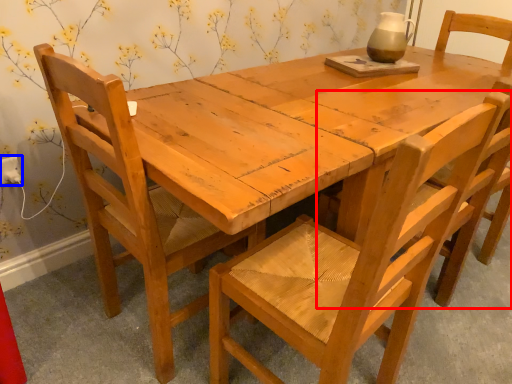
Question: Which of the following is the closest to the observer, chair (highlighted by a red box) or electric outlet (highlighted by a blue box)?

Choices:
 (A) chair
 (B) electric outlet

Answer: (A)